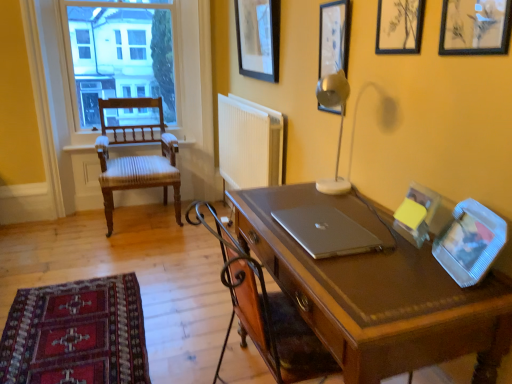
Question: Is black matte picture frame at upper right, arranged as the first picture frame when viewed from the front, facing away from metallic silver table lamp at upper right?

Choices:
 (A) no
 (B) yes

Answer: (A)

Question: Is black matte picture frame at upper right, arranged as the first picture frame when viewed from the front, further to camera compared to metallic silver table lamp at upper right?

Choices:
 (A) no
 (B) yes

Answer: (A)

Question: Can we say black matte picture frame at upper right, arranged as the first picture frame when viewed from the front, lies outside metallic silver table lamp at upper right?

Choices:
 (A) no
 (B) yes

Answer: (B)

Question: Can you confirm if black matte picture frame at upper right, positioned as the 1th picture frame in right-to-left order, is smaller than metallic silver table lamp at upper right?

Choices:
 (A) yes
 (B) no

Answer: (A)

Question: From a real-world perspective, is black matte picture frame at upper right, which is the fifth picture frame in back-to-front order, positioned under metallic silver table lamp at upper right based on gravity?

Choices:
 (A) no
 (B) yes

Answer: (A)

Question: Can you confirm if metallic silver table lamp at upper right is bigger than clear plastic picture frame at right, which ranks as the fourth picture frame in back-to-front order?

Choices:
 (A) yes
 (B) no

Answer: (A)

Question: Does metallic silver table lamp at upper right have a lesser height compared to clear plastic picture frame at right, arranged as the 2th picture frame when viewed from the front?

Choices:
 (A) no
 (B) yes

Answer: (A)

Question: Can you confirm if metallic silver table lamp at upper right is wider than clear plastic picture frame at right, which ranks as the fourth picture frame in back-to-front order?

Choices:
 (A) no
 (B) yes

Answer: (B)

Question: Does metallic silver table lamp at upper right come behind clear plastic picture frame at right, arranged as the 2th picture frame when viewed from the front?

Choices:
 (A) no
 (B) yes

Answer: (B)

Question: From a real-world perspective, is metallic silver table lamp at upper right positioned over clear plastic picture frame at right, which ranks as the fourth picture frame in back-to-front order, based on gravity?

Choices:
 (A) yes
 (B) no

Answer: (A)

Question: From the image's perspective, is metallic silver table lamp at upper right under clear plastic picture frame at right, arranged as the 2th picture frame when viewed from the front?

Choices:
 (A) yes
 (B) no

Answer: (B)

Question: Is metallic silver picture frame at upper right, which is the 2th picture frame in back-to-front order, surrounding metallic silver table lamp at upper right?

Choices:
 (A) yes
 (B) no

Answer: (B)